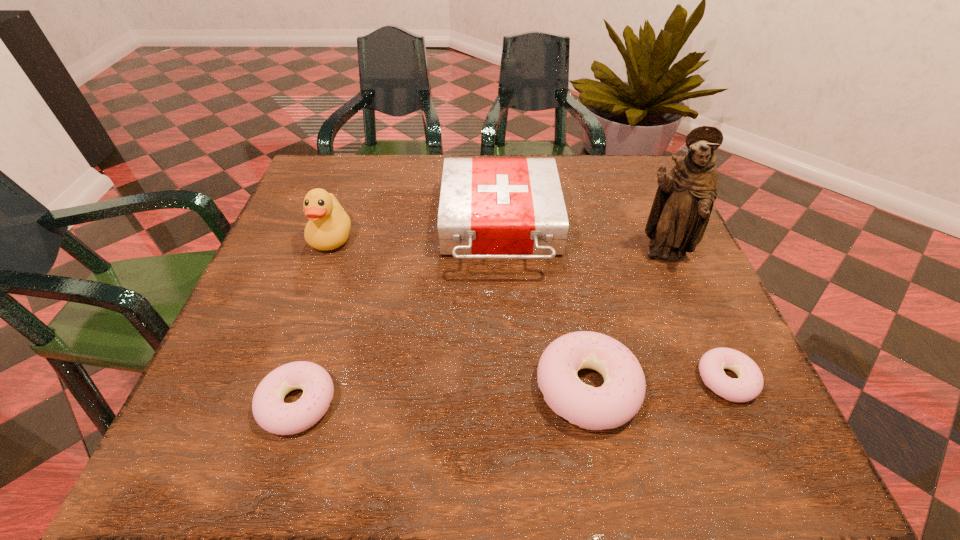
Where is `the fifth tallest object`? the fifth tallest object is located at coordinates (269, 410).

The image size is (960, 540). In order to click on the leftmost doughnut in this screenshot , I will do `click(269, 410)`.

Identify the location of the fourth tallest object. (618, 400).

The width and height of the screenshot is (960, 540). I want to click on the tallest doughnut, so click(x=618, y=400).

Identify the location of the shortest doughnut. (748, 386).

You are a GUI agent. You are given a task and a screenshot of the screen. Output one action in this format:
    pyautogui.click(x=<x>, y=<y>)
    Task: Click on the shortest object
    
    Given the screenshot: What is the action you would take?
    pyautogui.click(x=748, y=386)

Find the location of `the fifth shortest object`. the fifth shortest object is located at coordinates (328, 228).

I want to click on the third tallest object, so click(x=490, y=208).

Locate an element on the screen. The height and width of the screenshot is (540, 960). figurine is located at coordinates [x=680, y=213].

This screenshot has height=540, width=960. I want to click on vacant space located on the right of the fifth tallest object, so click(372, 403).